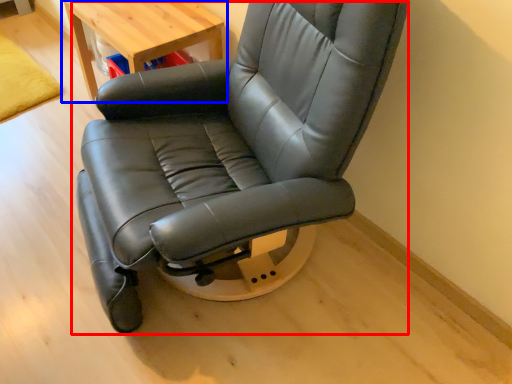
Question: Which of the following is the closest to the observer, chair (highlighted by a red box) or table (highlighted by a blue box)?

Choices:
 (A) chair
 (B) table

Answer: (A)